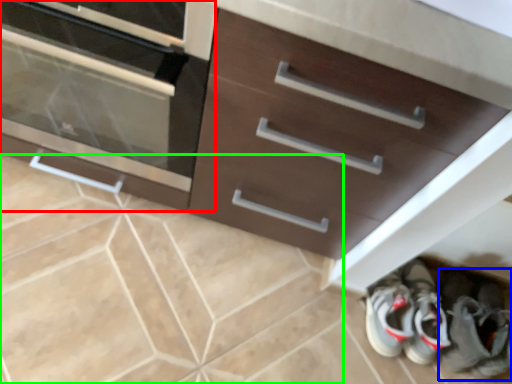
Question: Estimate the real-world distances between objects in this image. Which object is closer to chest of drawers (highlighted by a red box), footwear (highlighted by a blue box) or ceramic tile (highlighted by a green box)?

Choices:
 (A) footwear
 (B) ceramic tile

Answer: (B)